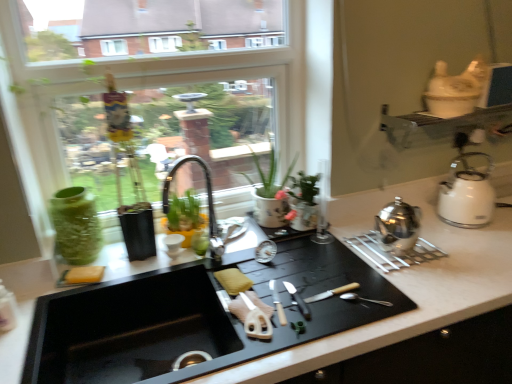
Locate an element on the screen. The image size is (512, 384). vacant space in front of satin silver teapot at right, placed as the 2th kitchen appliance when sorted from back to front is located at coordinates (416, 282).